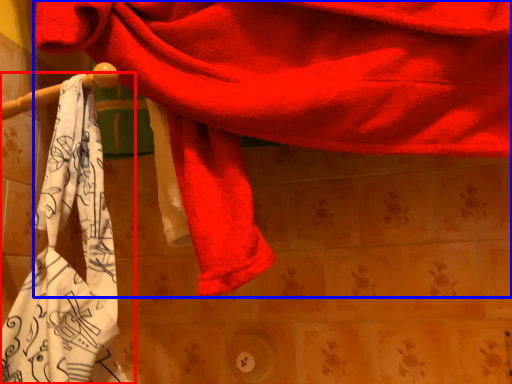
Question: Which object appears closest to the camera in this image, towel (highlighted by a red box) or towel (highlighted by a blue box)?

Choices:
 (A) towel
 (B) towel

Answer: (B)